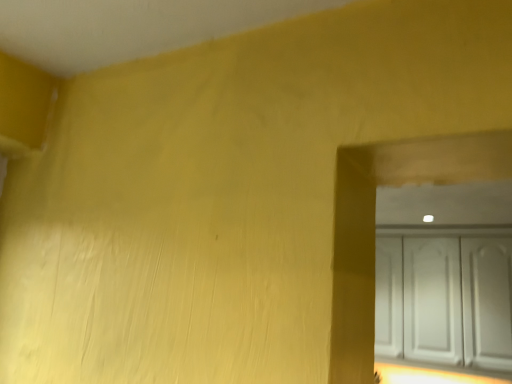
Describe the element at coordinates (445, 297) in the screenshot. I see `white matte cabinetry at right` at that location.

In order to face white matte cabinetry at right, should I rotate leftwards or rightwards?

To align with it, rotate right about 23.351°.

Identify the location of white matte cabinetry at right. This screenshot has height=384, width=512. (445, 297).

What are the coordinates of `white matte cabinetry at right` in the screenshot? It's located at (445, 297).